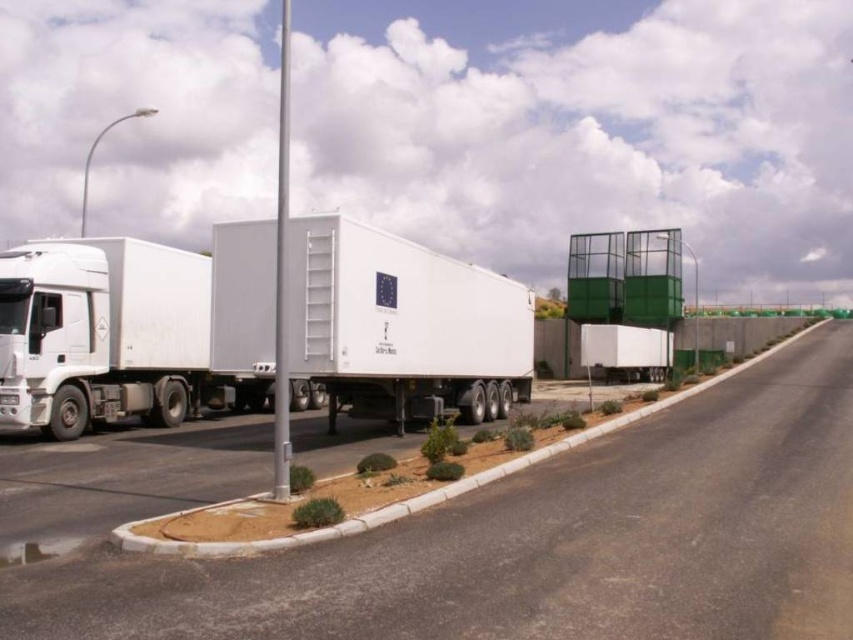
You are standing at the entrance of the truck stop and want to reach the asphalt road at center. Which direction should you walk to get there?

The asphalt road at center is located at point coordinates, so you should walk towards the center of the scene to reach it.

You are driving a car and need to park behind the white matte trailer truck at center. Can you safely park your car on the asphalt road at center without blocking the truck?

The asphalt road at center is closer to the viewer than the white matte trailer truck at center, so parking behind the truck would require moving forward past the road, which is not possible. Therefore, you cannot safely park your car on the asphalt road at center without blocking the truck.

You are standing at the point marked by the coordinates point (403, 324). Describe the object you are currently standing on.

You are standing on the white matte trailer truck at center.